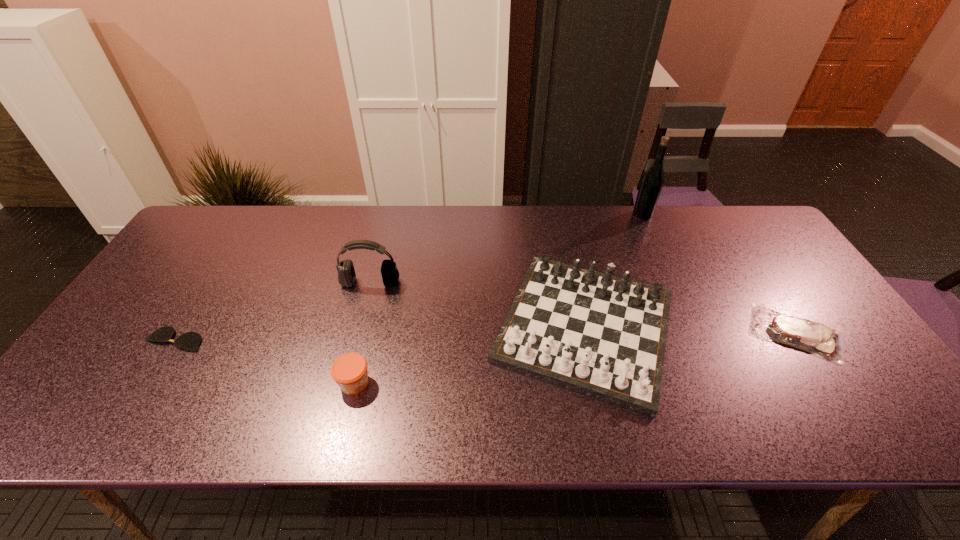
Locate an element on the screen. This screenshot has height=540, width=960. the farthest object is located at coordinates (652, 182).

Locate an element on the screen. beer bottle is located at coordinates (652, 182).

Where is `the second tallest object`? The image size is (960, 540). the second tallest object is located at coordinates (346, 273).

Where is `chessboard`? chessboard is located at coordinates (604, 336).

The width and height of the screenshot is (960, 540). I want to click on the third shortest object, so click(350, 372).

This screenshot has width=960, height=540. Find the location of `the rightmost object`. the rightmost object is located at coordinates (814, 337).

The width and height of the screenshot is (960, 540). In order to click on steak in this screenshot , I will do `click(814, 337)`.

The height and width of the screenshot is (540, 960). I want to click on the shortest object, so click(190, 341).

Image resolution: width=960 pixels, height=540 pixels. I want to click on spectacles, so click(190, 341).

At what (x,y) coordinates should I click in order to perform the action: click on vacant space located 0.170m on the right of the farthest object. Please return your answer as a coordinate pair (x, y). This screenshot has height=540, width=960. Looking at the image, I should click on (703, 214).